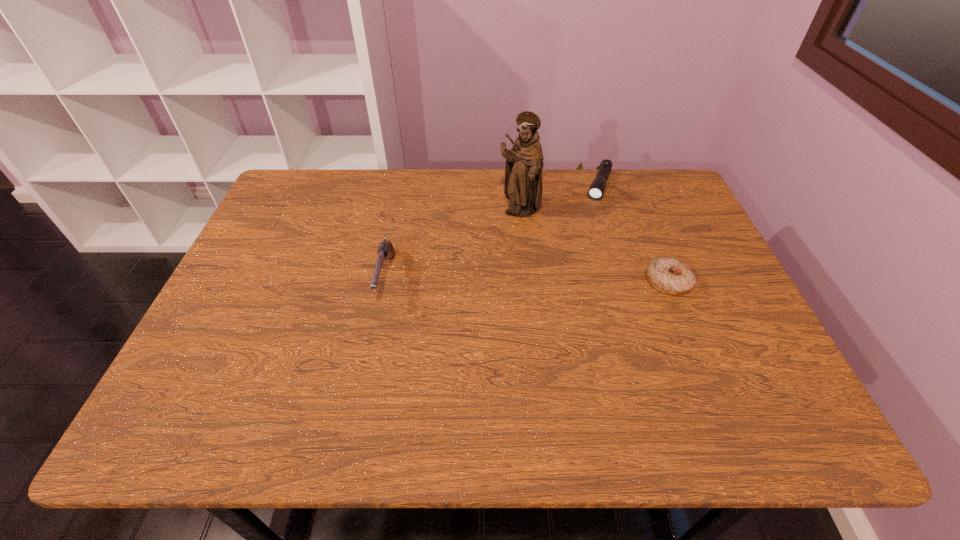
This screenshot has height=540, width=960. I want to click on free space on the desktop that is between the leftmost object and the doughnut and is positioned on the front-facing side of the figurine, so click(525, 280).

Identify the location of vacant space on the desktop that is between the leftmost object and the doughnut and is positioned at the lens end of the flashlight. The width and height of the screenshot is (960, 540). (562, 281).